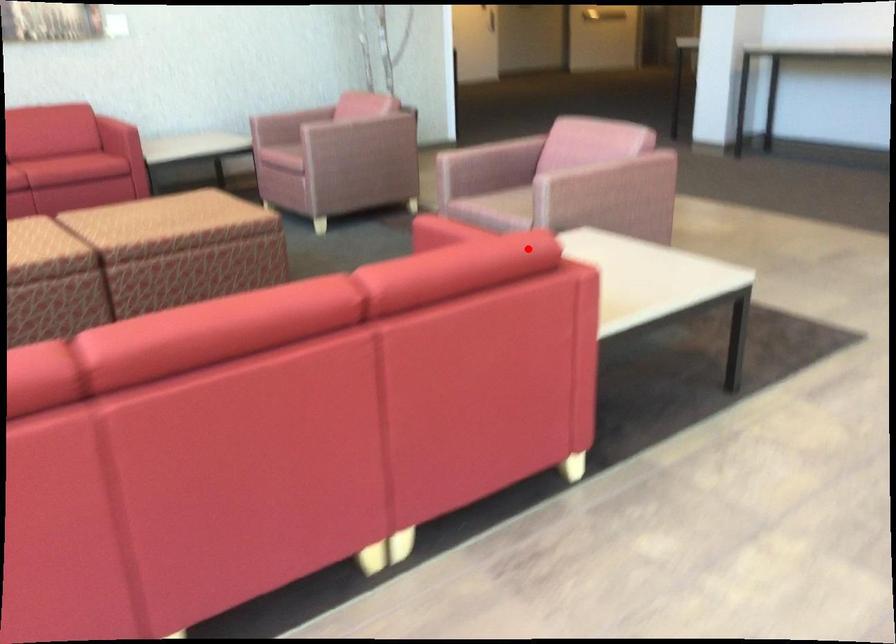
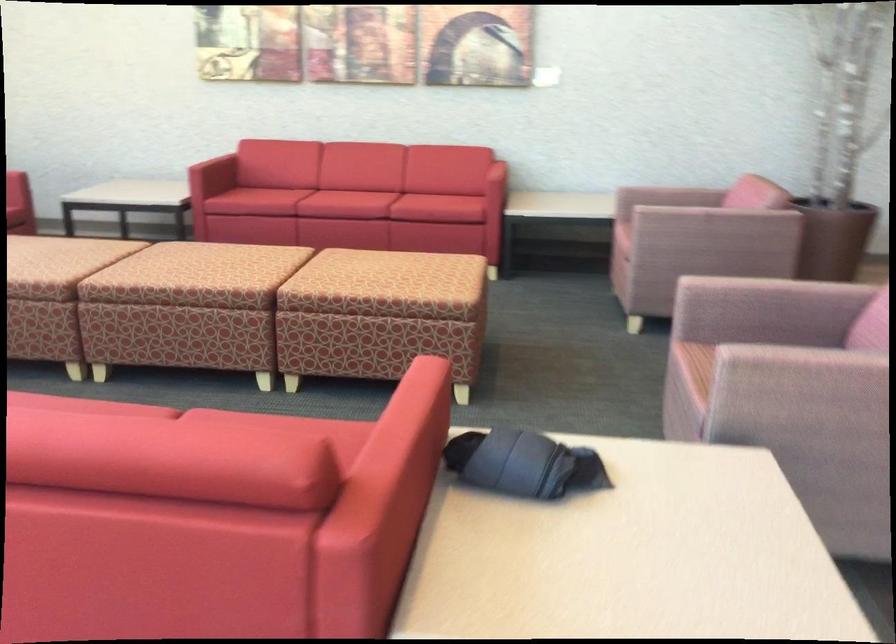
Where in the second image is the point corresponding to the highlighted location from the first image?

(397, 464)